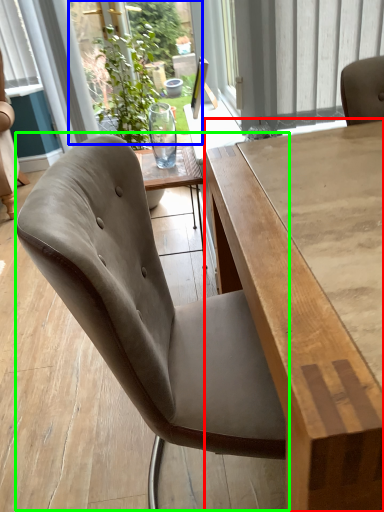
Question: Which object is the closest to the table (highlighted by a red box)? Choose among these: window screen (highlighted by a blue box) or chair (highlighted by a green box).

Choices:
 (A) window screen
 (B) chair

Answer: (B)